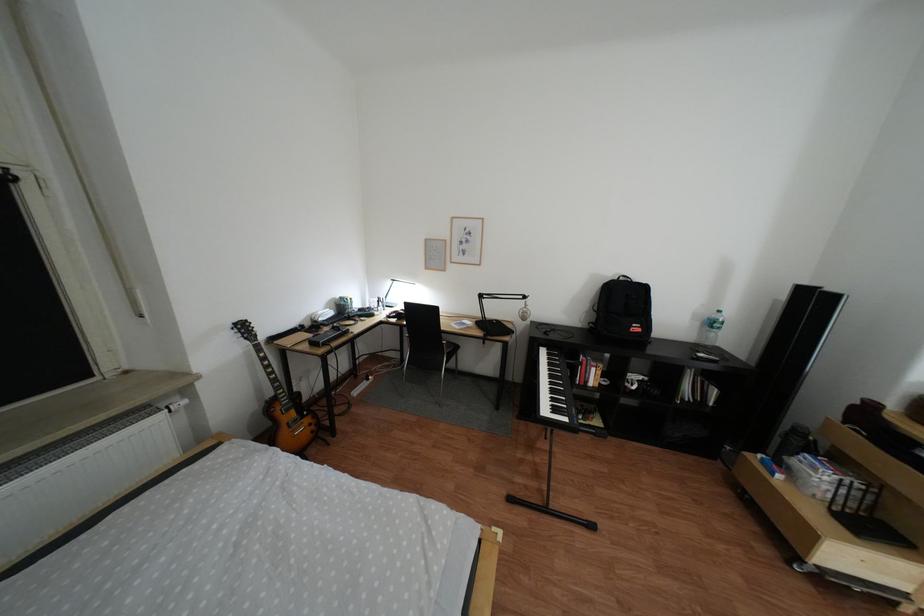
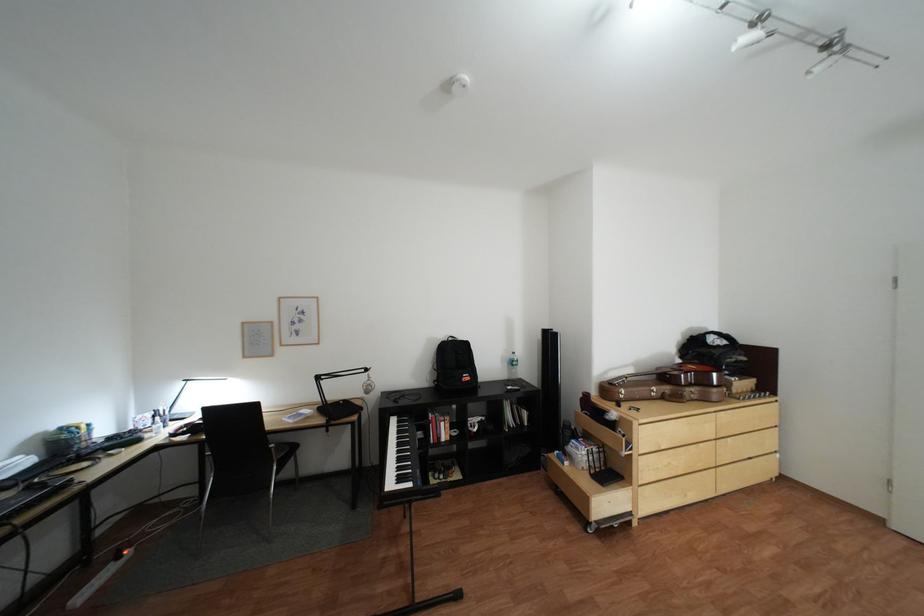
Locate, in the second image, the point that corresponds to [456,341] in the first image.

(284, 445)